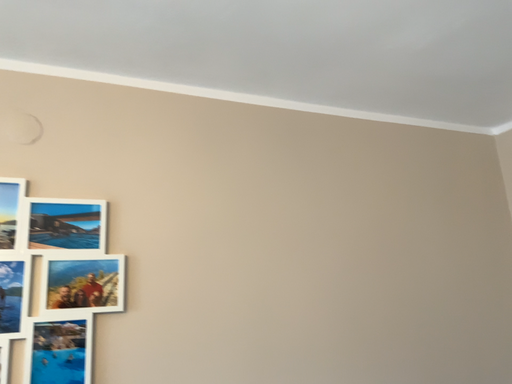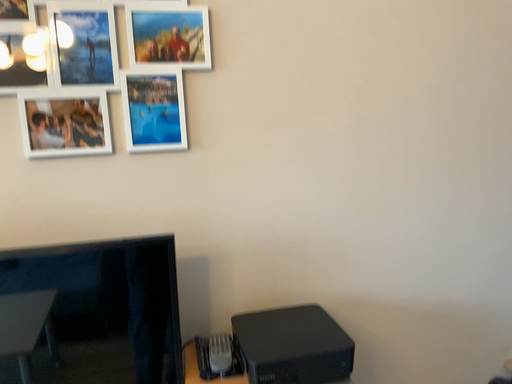
Question: How did the camera likely rotate when shooting the video?

Choices:
 (A) rotated downward
 (B) rotated upward

Answer: (A)